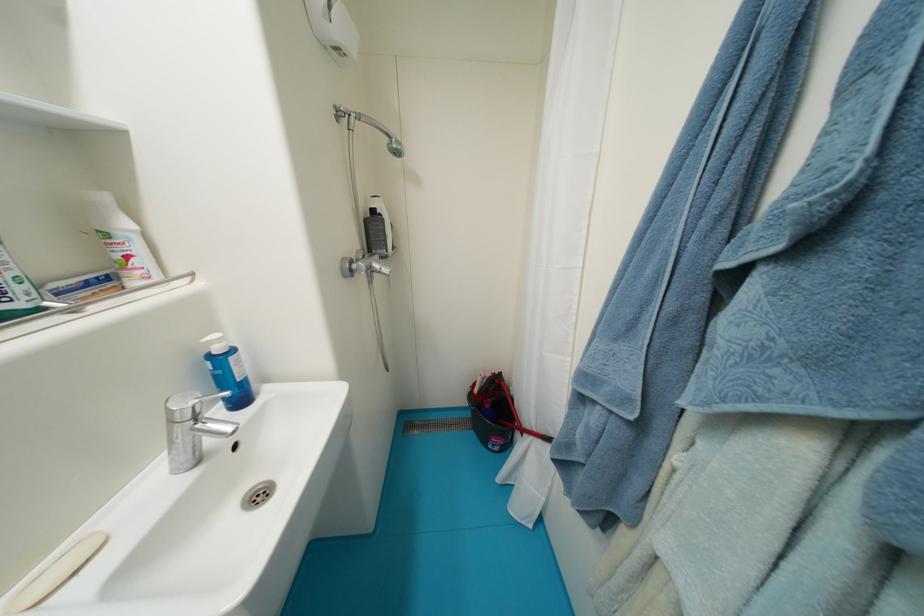
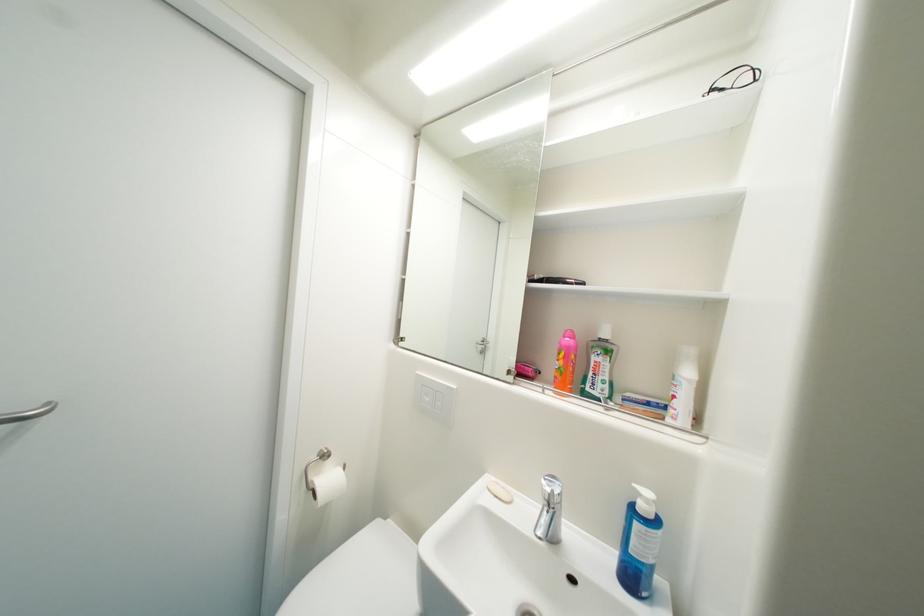
Locate, in the second image, the point that corresponds to (x=82, y=575) in the first image.

(503, 498)